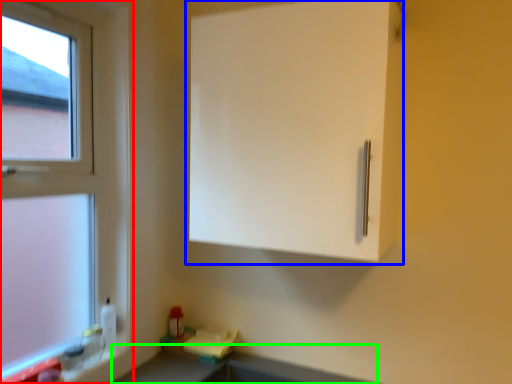
Question: Based on their relative distances, which object is farther from window (highlighted by a red box)? Choose from cabinetry (highlighted by a blue box) and counter top (highlighted by a green box).

Choices:
 (A) cabinetry
 (B) counter top

Answer: (B)